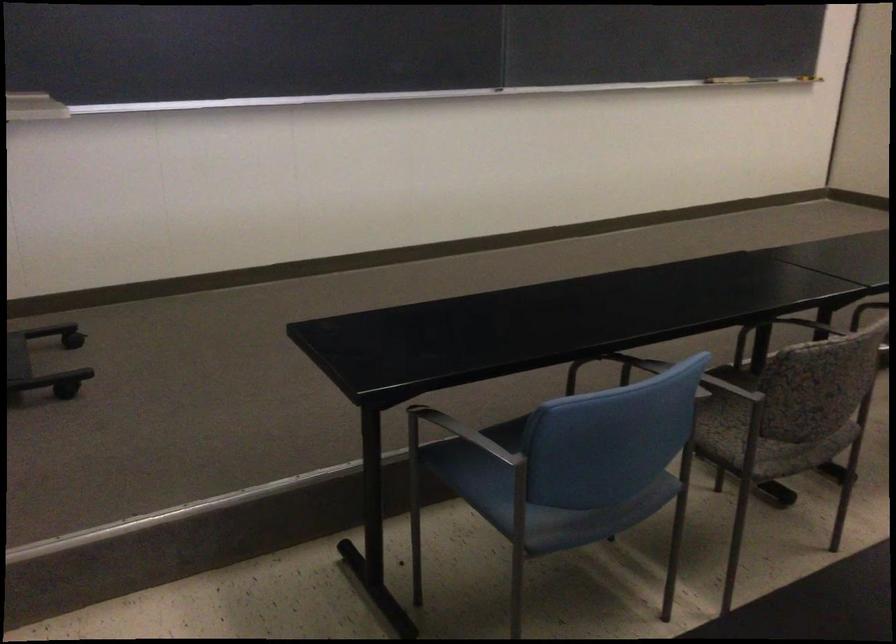
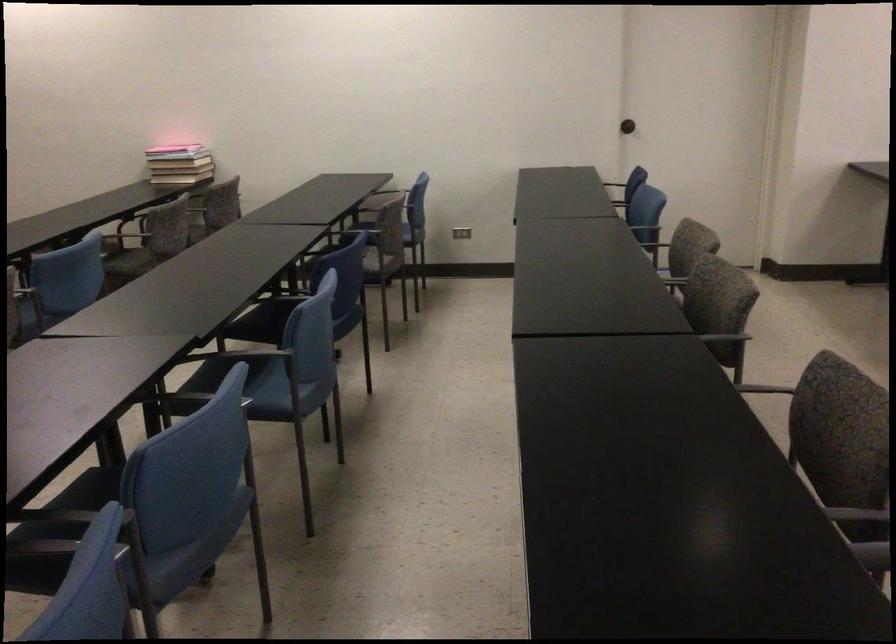
Question: The camera is either moving clockwise (left) or counter-clockwise (right) around the object. The first image is from the beginning of the video and the second image is from the end. Is the camera moving left or right when shooting the video?

Choices:
 (A) Left
 (B) Right

Answer: (A)